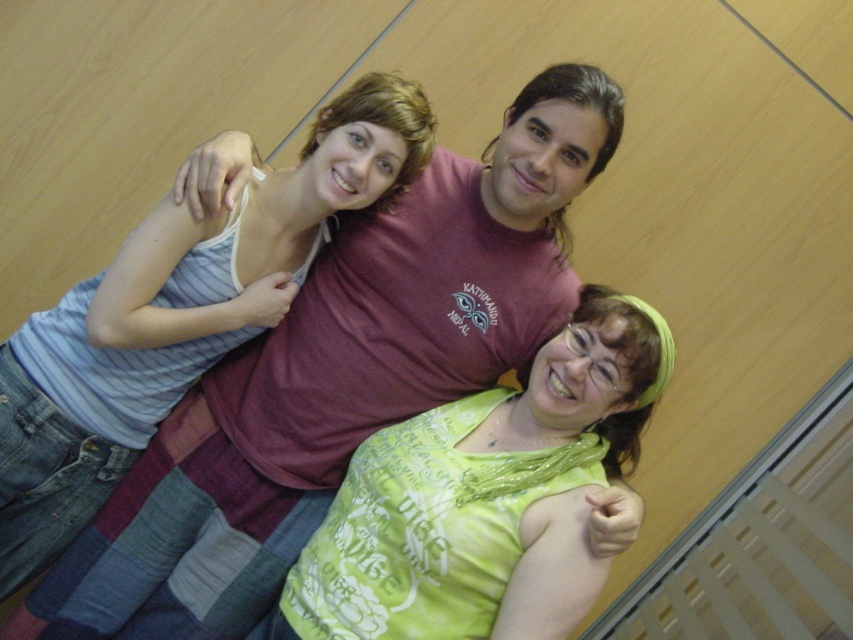
Question: Which point is closer to the camera taking this photo?

Choices:
 (A) (405, 556)
 (B) (167, 397)

Answer: (A)

Question: Is green fabric shirt at center to the left of striped cotton tank top at upper left from the viewer's perspective?

Choices:
 (A) no
 (B) yes

Answer: (A)

Question: Is green fabric shirt at center above striped cotton tank top at upper left?

Choices:
 (A) no
 (B) yes

Answer: (A)

Question: Can you confirm if green fabric shirt at center is positioned to the left of striped cotton tank top at upper left?

Choices:
 (A) no
 (B) yes

Answer: (A)